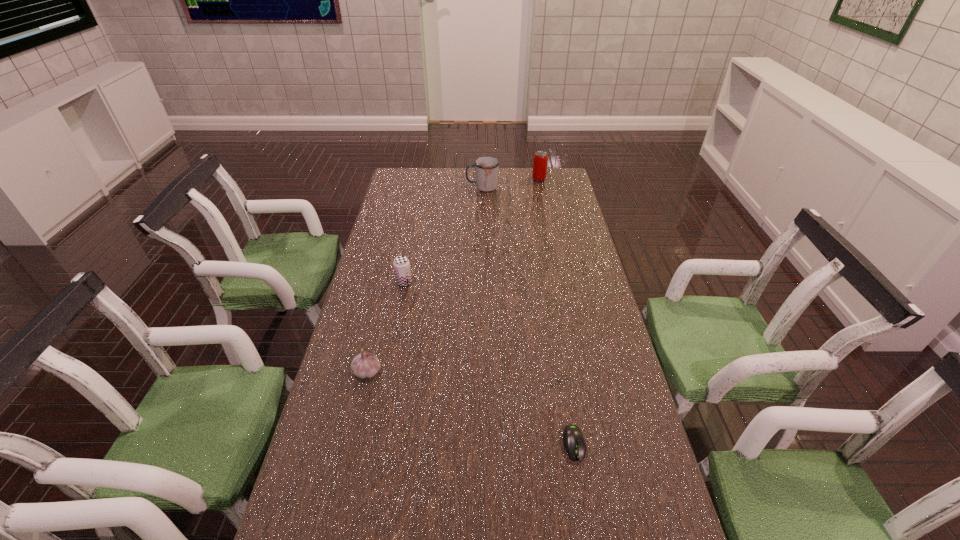
Find the location of a particular element. This screenshot has height=540, width=960. computer mouse that is at the right edge is located at coordinates 573,439.

Locate an element on the screen. The width and height of the screenshot is (960, 540). object that is at the far right corner is located at coordinates (539, 172).

I want to click on free space at the far edge of the desktop, so click(x=472, y=184).

The width and height of the screenshot is (960, 540). In the image, there is a desktop. Identify the location of vacant space at the left edge. (376, 309).

Where is `vacant space at the right edge`? Image resolution: width=960 pixels, height=540 pixels. vacant space at the right edge is located at coordinates (573, 292).

The width and height of the screenshot is (960, 540). In the image, there is a desktop. What are the coordinates of `vacant space at the far right corner` in the screenshot? It's located at (564, 173).

I want to click on free space between the second nearest object and the left beer can, so click(x=386, y=327).

Identify the location of free space between the fourth farthest object and the nearest object. The width and height of the screenshot is (960, 540). (470, 408).

Identify the location of blank region between the nearest object and the farther beer can. Image resolution: width=960 pixels, height=540 pixels. (557, 312).

Where is `vacant space that's between the computer mouse and the garlic`? The width and height of the screenshot is (960, 540). vacant space that's between the computer mouse and the garlic is located at coordinates (470, 408).